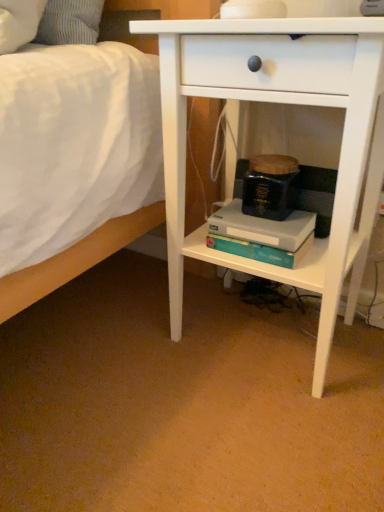
Question: Can you confirm if white matte nightstand at center is wider than teal matte paperback book at center, which is counted as the 2th paperback book, starting from the bottom?

Choices:
 (A) yes
 (B) no

Answer: (A)

Question: Can you confirm if white matte nightstand at center is shorter than teal matte paperback book at center, which is counted as the 2th paperback book, starting from the bottom?

Choices:
 (A) no
 (B) yes

Answer: (A)

Question: Can you confirm if white matte nightstand at center is smaller than teal matte paperback book at center, which is counted as the 2th paperback book, starting from the bottom?

Choices:
 (A) no
 (B) yes

Answer: (A)

Question: Would you say white matte nightstand at center is a long distance from teal matte paperback book at center, which is the 1th paperback book in top-to-bottom order?

Choices:
 (A) no
 (B) yes

Answer: (A)

Question: Considering the relative positions of white matte nightstand at center and teal matte paperback book at center, which is the 1th paperback book in top-to-bottom order, in the image provided, is white matte nightstand at center to the right of teal matte paperback book at center, which is the 1th paperback book in top-to-bottom order, from the viewer's perspective?

Choices:
 (A) no
 (B) yes

Answer: (B)

Question: From a real-world perspective, does white matte nightstand at center stand above teal matte paperback book at center, which is counted as the 2th paperback book, starting from the bottom?

Choices:
 (A) no
 (B) yes

Answer: (A)

Question: Can you confirm if teal matte paperback book at center, which is counted as the 2th paperback book, starting from the bottom, is bigger than teal matte paperback book at center, which is counted as the first paperback book, starting from the bottom?

Choices:
 (A) yes
 (B) no

Answer: (B)

Question: Can you confirm if teal matte paperback book at center, which is the 1th paperback book in top-to-bottom order, is thinner than teal matte paperback book at center, the second paperback book viewed from the top?

Choices:
 (A) no
 (B) yes

Answer: (B)

Question: Does teal matte paperback book at center, which is the 1th paperback book in top-to-bottom order, have a lesser height compared to teal matte paperback book at center, which is counted as the first paperback book, starting from the bottom?

Choices:
 (A) no
 (B) yes

Answer: (A)

Question: From a real-world perspective, is teal matte paperback book at center, which is the 1th paperback book in top-to-bottom order, on teal matte paperback book at center, the second paperback book viewed from the top?

Choices:
 (A) no
 (B) yes

Answer: (B)

Question: Is teal matte paperback book at center, which is the 1th paperback book in top-to-bottom order, positioned beyond the bounds of teal matte paperback book at center, the second paperback book viewed from the top?

Choices:
 (A) yes
 (B) no

Answer: (A)

Question: From the image's perspective, is teal matte paperback book at center, which is counted as the 2th paperback book, starting from the bottom, beneath teal matte paperback book at center, the second paperback book viewed from the top?

Choices:
 (A) no
 (B) yes

Answer: (A)

Question: Does teal matte paperback book at center, which is counted as the first paperback book, starting from the bottom, have a larger size compared to white matte nightstand at center?

Choices:
 (A) no
 (B) yes

Answer: (A)